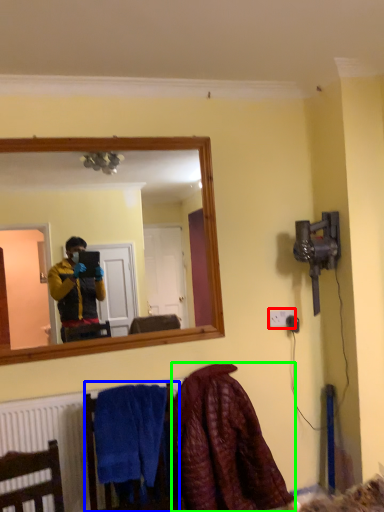
Question: Considering the real-world distances, which object is farthest from electric outlet (highlighted by a red box)? armchair (highlighted by a blue box) or blanket (highlighted by a green box)?

Choices:
 (A) armchair
 (B) blanket

Answer: (A)